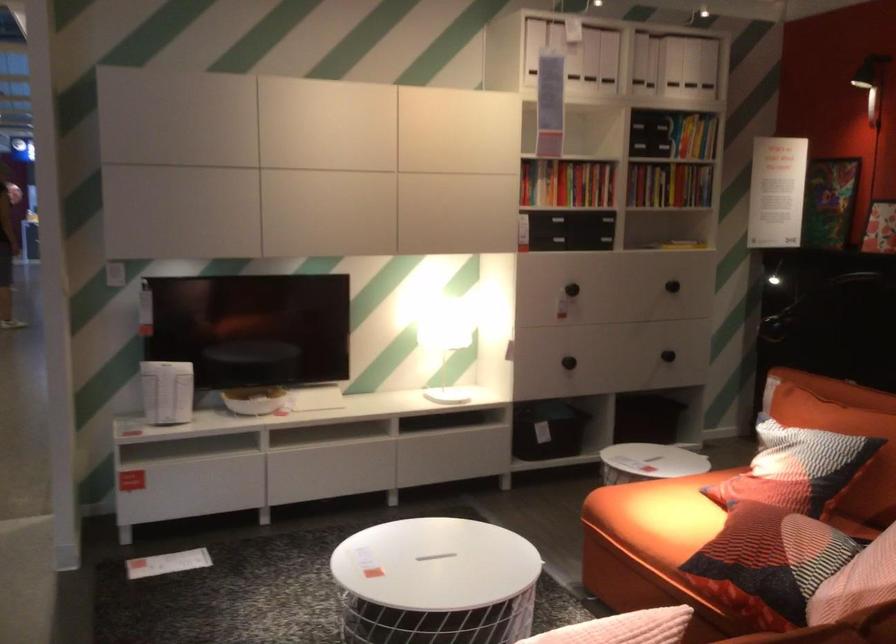
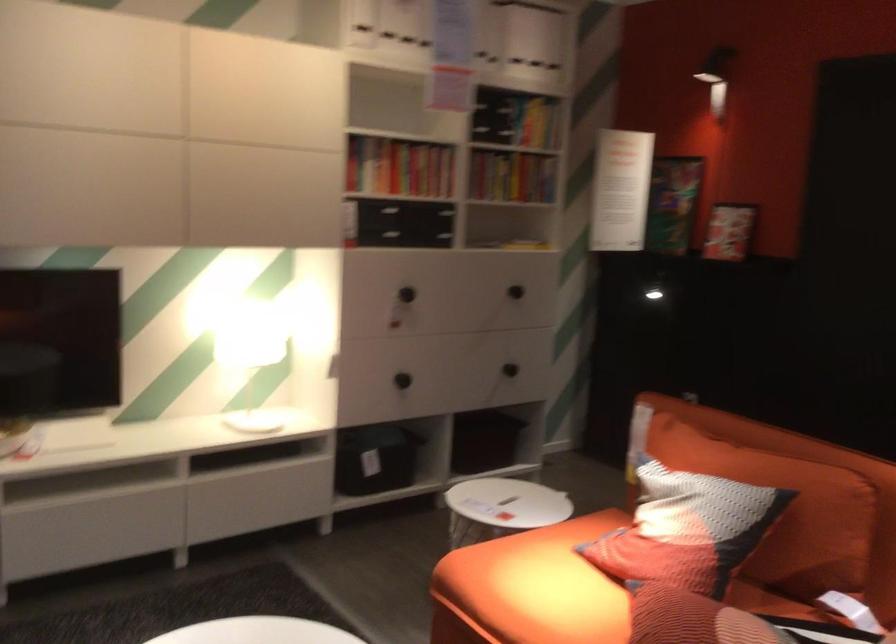
In the second image, find the point that corresponds to (x=572, y=172) in the first image.

(399, 167)